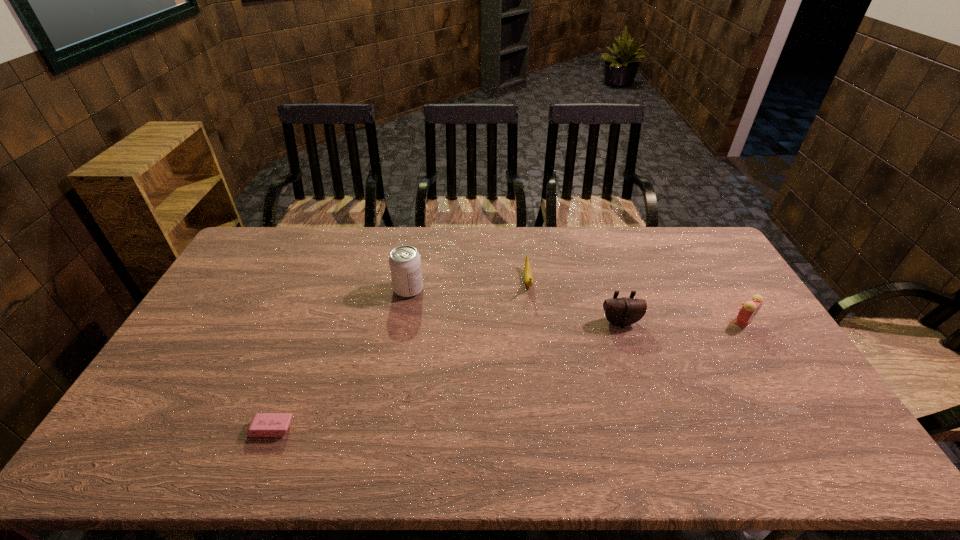
The width and height of the screenshot is (960, 540). What are the coordinates of `soda can` in the screenshot? It's located at (405, 264).

Identify the location of the tallest object. (405, 264).

You are a GUI agent. You are given a task and a screenshot of the screen. Output one action in this format:
    pyautogui.click(x=<x>, y=<y>)
    Task: Click on the pouch
    The width and height of the screenshot is (960, 540).
    Given the screenshot: What is the action you would take?
    pyautogui.click(x=623, y=311)

Identify the location of alarm clock. The width and height of the screenshot is (960, 540). (748, 311).

In order to click on the fourth tallest object in this screenshot , I will do `click(528, 278)`.

The height and width of the screenshot is (540, 960). I want to click on banana, so click(528, 278).

The width and height of the screenshot is (960, 540). I want to click on the leftmost object, so click(263, 424).

At what (x,y) coordinates should I click in order to perform the action: click on the nearest object. Please return your answer as a coordinate pair (x, y). The width and height of the screenshot is (960, 540). Looking at the image, I should click on (263, 424).

At what (x,y) coordinates should I click in order to perform the action: click on free location located 0.080m on the front of the soda can. Please return your answer as a coordinate pair (x, y). This screenshot has width=960, height=540. Looking at the image, I should click on (404, 318).

You are a GUI agent. You are given a task and a screenshot of the screen. Output one action in this format:
    pyautogui.click(x=<x>, y=<y>)
    Task: Click on the vacant space situated 0.150m with the flap open on the fourth object from left to right
    
    Given the screenshot: What is the action you would take?
    pyautogui.click(x=636, y=369)